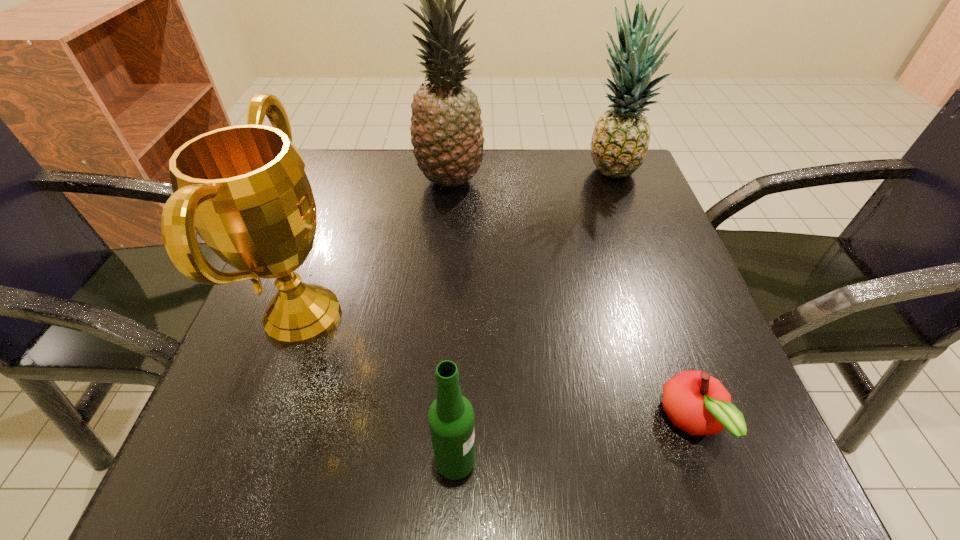
Find the location of a particular element. The height and width of the screenshot is (540, 960). beer bottle present at the near edge is located at coordinates (451, 416).

Where is `apple that is at the near edge`? Image resolution: width=960 pixels, height=540 pixels. apple that is at the near edge is located at coordinates (697, 403).

Locate an element on the screen. This screenshot has height=540, width=960. object that is at the left edge is located at coordinates (243, 188).

This screenshot has height=540, width=960. I want to click on pineapple present at the right edge, so click(x=620, y=141).

At what (x,y) coordinates should I click in order to perform the action: click on apple situated at the right edge. Please return your answer as a coordinate pair (x, y). Image resolution: width=960 pixels, height=540 pixels. Looking at the image, I should click on (697, 403).

Find the location of `object situated at the far right corner`. object situated at the far right corner is located at coordinates (620, 141).

Locate an element on the screen. object that is positioned at the near right corner is located at coordinates (697, 403).

This screenshot has width=960, height=540. I want to click on vacant area at the far edge, so click(x=548, y=190).

The width and height of the screenshot is (960, 540). In order to click on free space at the near edge of the desktop in this screenshot , I will do `click(354, 474)`.

The image size is (960, 540). I want to click on blank area at the left edge, so [235, 429].